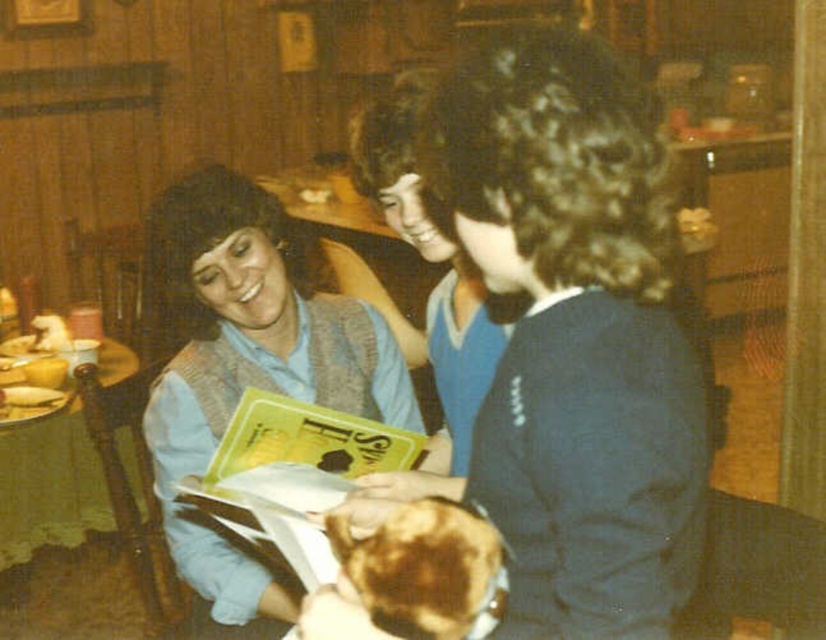
Is yellow paper book at center to the right of brown crispy bread at lower center from the viewer's perspective?

Incorrect, yellow paper book at center is not on the right side of brown crispy bread at lower center.

Who is taller, yellow paper book at center or brown crispy bread at lower center?

With more height is yellow paper book at center.

Locate an element on the screen. yellow paper book at center is located at coordinates (293, 472).

Who is more forward, (210, 406) or (354, 552)?

Positioned in front is point (354, 552).

What do you see at coordinates (247, 365) in the screenshot?
I see `matte blue sweater at center` at bounding box center [247, 365].

Locate an element on the screen. The image size is (826, 640). matte blue sweater at center is located at coordinates (247, 365).

Which is above, dark blue sweater at center or matte blue sweater at center?

dark blue sweater at center

Is dark blue sweater at center below matte blue sweater at center?

No.

Who is more distant from viewer, (577, 324) or (345, 356)?

The point (345, 356) is behind.

Find the location of a particular element. This screenshot has height=640, width=826. dark blue sweater at center is located at coordinates tap(573, 342).